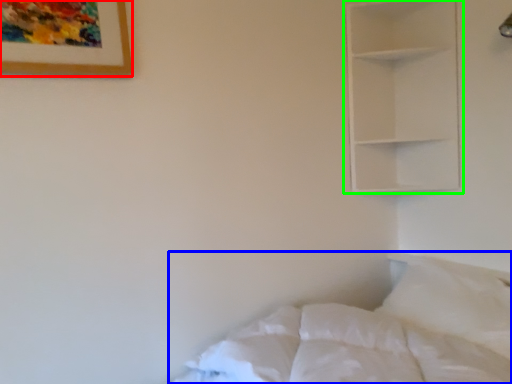
Question: Which object is the farthest from picture frame (highlighted by a red box)? Choose among these: bed (highlighted by a blue box) or shelf (highlighted by a green box).

Choices:
 (A) bed
 (B) shelf

Answer: (B)